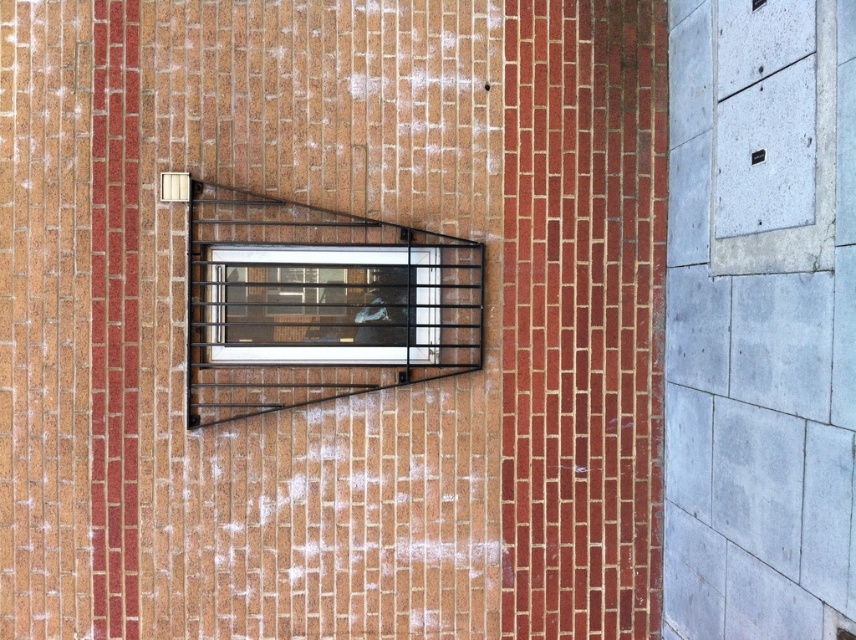
You are standing in front of the brick wall and want to enter through the clear glass window at center. However, there is a black metal fire escape at center blocking your path. Which side of the window should you approach from to avoid the fire escape?

You should approach from the left side of the clear glass window at center because the black metal fire escape at center is to the right of it, so the left side is unobstructed.

You are standing in front of a brick wall with a window and a security grill. You notice two points marked on the wall at coordinates point (259, 198) and point (355, 291). Based on the scene, which point is closer to you?

Point (259, 198) is in front of point (355, 291), so it is closer to you.

You are standing in front of a brick wall with a window and a security grill. You want to reach the clear glass window at center to look outside. Is the black metal fire escape at center blocking your view?

The black metal fire escape at center is closer to the viewer than the clear glass window at center, so it is blocking your view of the clear glass window at center.